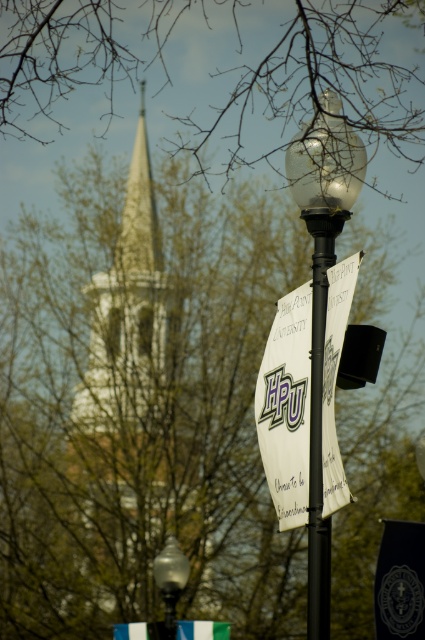
Is point (306, 394) more distant than point (142, 362)?

That is False.

Measure the distance between white paper sign at center and white stone tower at upper center.

A distance of 62.10 meters exists between white paper sign at center and white stone tower at upper center.

Is point (260, 456) positioned behind point (127, 260)?

No, (260, 456) is in front of (127, 260).

This screenshot has height=640, width=425. I want to click on white paper sign at center, so click(x=286, y=406).

Which of these two, matte glass street light at center or black metal pole at center, stands shorter?

black metal pole at center

This screenshot has width=425, height=640. I want to click on matte glass street light at center, so click(322, 301).

Does matte glass street light at center lie behind matte glass street light at lower left?

No.

Where is `matte glass street light at center`? The height and width of the screenshot is (640, 425). matte glass street light at center is located at coordinates (322, 301).

I want to click on matte glass street light at center, so click(x=322, y=301).